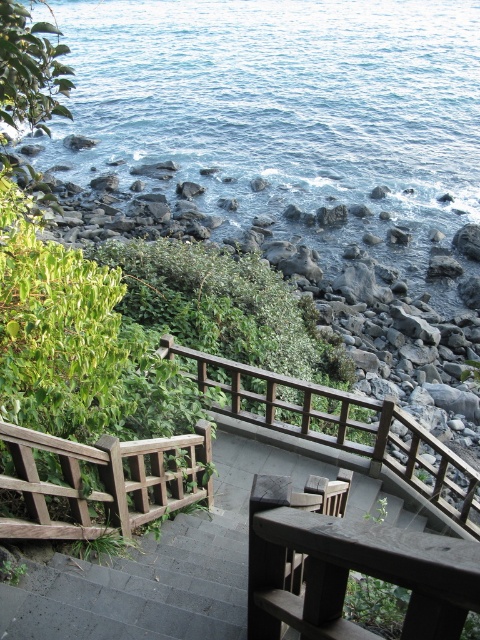
You are standing on the wooden staircase leading down to the rocky shoreline and want to grab the brown wooden balustrade at center for support. Based on its position, can you estimate whether it is within your immediate reach without moving your feet?

The brown wooden balustrade at center is located at point [340,428], which suggests it is positioned in a reachable area from the staircase steps. Since you are on the staircase, it should be within immediate reach without needing to move your feet.

Based on the photo, what object is located at the point with coordinates (340,428)?

The brown wooden balustrade at center is located at the point with coordinates (340,428).